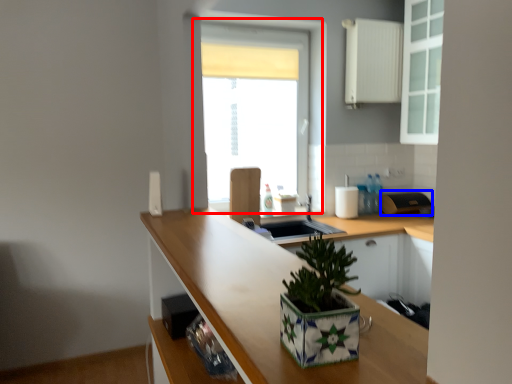
Question: Which point is further to the camera, window (highlighted by a red box) or appliance (highlighted by a blue box)?

Choices:
 (A) window
 (B) appliance

Answer: (B)